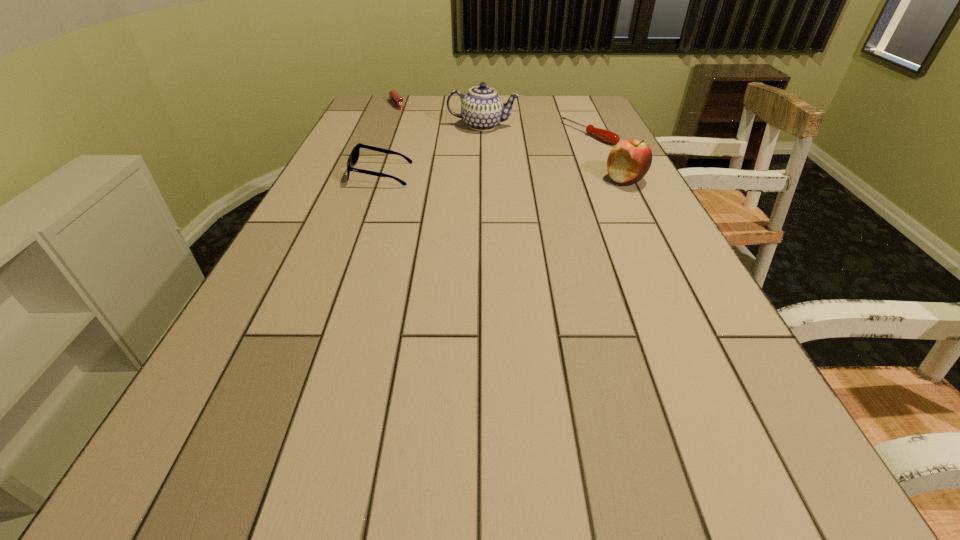
Find the location of a particular element. The width and height of the screenshot is (960, 540). the third tallest object is located at coordinates [354, 156].

The width and height of the screenshot is (960, 540). Find the location of `the fourth shortest object`. the fourth shortest object is located at coordinates (628, 162).

Locate an element on the screen. This screenshot has width=960, height=540. screwdriver is located at coordinates (607, 136).

The image size is (960, 540). In order to click on the third object from left to right in this screenshot , I will do `click(482, 108)`.

The height and width of the screenshot is (540, 960). Find the location of `the tallest object`. the tallest object is located at coordinates tap(482, 108).

Find the location of a particular element. This screenshot has height=540, width=960. the second shortest object is located at coordinates (394, 97).

Find the location of `stapler`. stapler is located at coordinates (394, 97).

In order to click on vacant region located 0.080m on the front-facing side of the third tallest object in this screenshot , I will do `click(323, 174)`.

Locate an element on the screen. This screenshot has width=960, height=540. vacant area situated on the bitten side of the apple is located at coordinates (499, 180).

Where is `vacant space located on the bitten side of the apple`? This screenshot has width=960, height=540. vacant space located on the bitten side of the apple is located at coordinates (517, 180).